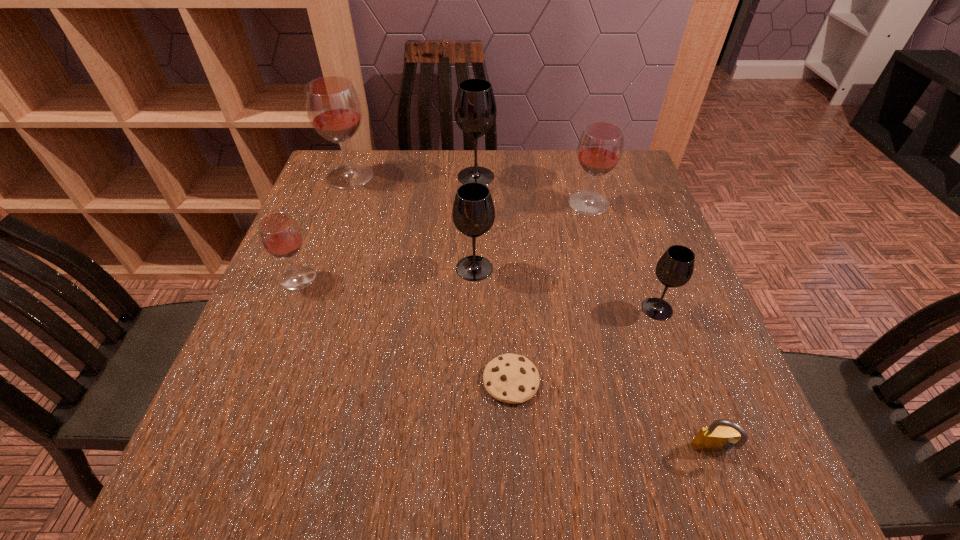
Identify which object is the fifth closest to the farthest gray wineglass. Please provide its 2D coordinates. Your answer should be formatted as a tuple, i.e. [(x, y)], where the tuple contains the x and y coordinates of a point satisfying the conditions above.

[(675, 267)]

The image size is (960, 540). I want to click on wineglass that is the fourth closest to the brown cookie, so click(600, 147).

Locate an element on the screen. This screenshot has height=540, width=960. wineglass that can be found as the closest to the second biggest gray wineglass is located at coordinates (600, 147).

Identify which gray wineglass is located as the nearest to the third farthest wineglass. Please provide its 2D coordinates. Your answer should be formatted as a tuple, i.e. [(x, y)], where the tuple contains the x and y coordinates of a point satisfying the conditions above.

[(475, 111)]

Select which gray wineglass appears as the closest to the biggest red wineglass. Please provide its 2D coordinates. Your answer should be formatted as a tuple, i.e. [(x, y)], where the tuple contains the x and y coordinates of a point satisfying the conditions above.

[(475, 111)]

Where is `the second closest red wineglass to the rightmost red wineglass`? the second closest red wineglass to the rightmost red wineglass is located at coordinates (280, 235).

At what (x,y) coordinates should I click in order to perform the action: click on red wineglass that is the nearest to the nearest object. Please return your answer as a coordinate pair (x, y). Image resolution: width=960 pixels, height=540 pixels. Looking at the image, I should click on (600, 147).

You are a GUI agent. You are given a task and a screenshot of the screen. Output one action in this format:
    pyautogui.click(x=<x>, y=<y>)
    Task: Click on the vacant space that satisfies the following two spatial constraints: 1. on the front side of the smallest red wineglass; 2. on the right side of the third nearest object
    
    Given the screenshot: What is the action you would take?
    pyautogui.click(x=286, y=309)

The image size is (960, 540). Find the location of `free space that satisfies the following two spatial constraints: 1. on the back side of the second smallest gray wineglass; 2. on the right side of the biggest gray wineglass`. free space that satisfies the following two spatial constraints: 1. on the back side of the second smallest gray wineglass; 2. on the right side of the biggest gray wineglass is located at coordinates (475, 177).